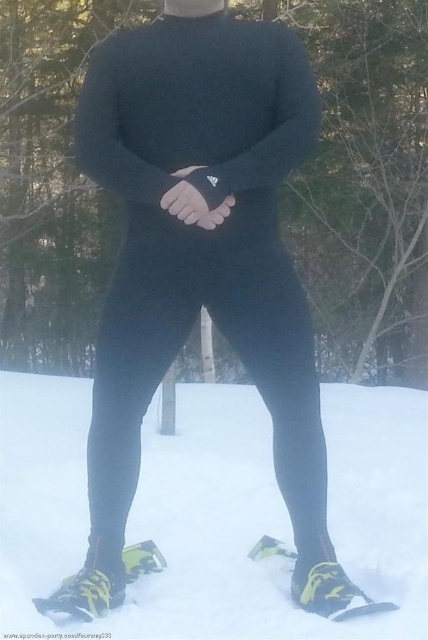
Question: Which point is farther to the camera?

Choices:
 (A) black matte leggings at center
 (B) yellow-green plastic snowshoes at lower center

Answer: (A)

Question: Can you confirm if yellow-green plastic snowshoes at lower center is positioned to the right of black matte leggings at center?

Choices:
 (A) yes
 (B) no

Answer: (B)

Question: Does yellow-green plastic snowshoes at lower center have a lesser width compared to black matte leggings at center?

Choices:
 (A) yes
 (B) no

Answer: (B)

Question: Does yellow-green plastic snowshoes at lower center appear under black matte leggings at center?

Choices:
 (A) no
 (B) yes

Answer: (B)

Question: Among these points, which one is nearest to the camera?

Choices:
 (A) (124, 513)
 (B) (312, 632)

Answer: (B)

Question: Which of the following is the farthest from the observer?

Choices:
 (A) (47, 618)
 (B) (223, 243)

Answer: (B)